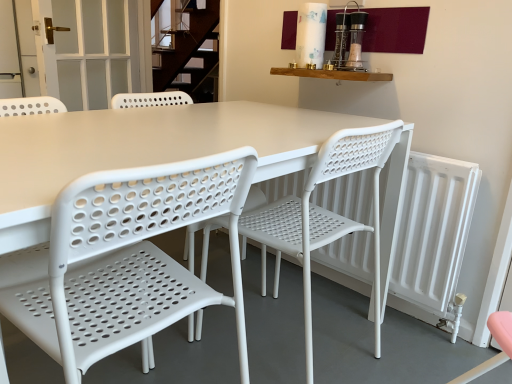
Question: Considering the relative sizes of white matte radiator at right and white plastic chair at center, placed as the 1th chair when sorted from right to left, in the image provided, is white matte radiator at right wider than white plastic chair at center, placed as the 1th chair when sorted from right to left,?

Choices:
 (A) yes
 (B) no

Answer: (B)

Question: From the image's perspective, does white matte radiator at right appear higher than white plastic chair at center, the 2th chair from the left?

Choices:
 (A) yes
 (B) no

Answer: (A)

Question: Would you say white plastic chair at center, the 2th chair from the left, is part of white matte radiator at right's contents?

Choices:
 (A) yes
 (B) no

Answer: (B)

Question: Does white matte radiator at right touch white plastic chair at center, the 2th chair from the left?

Choices:
 (A) no
 (B) yes

Answer: (A)

Question: Are white matte radiator at right and white plastic chair at center, placed as the 1th chair when sorted from right to left, far apart?

Choices:
 (A) no
 (B) yes

Answer: (A)

Question: In terms of height, does white frosted glass door at upper left look taller or shorter compared to white plastic chair at center, placed as the first chair when sorted from left to right?

Choices:
 (A) tall
 (B) short

Answer: (B)

Question: Relative to white plastic chair at center, which ranks as the second chair in right-to-left order, is white frosted glass door at upper left in front or behind?

Choices:
 (A) behind
 (B) front

Answer: (A)

Question: From the image's perspective, is white frosted glass door at upper left above or below white plastic chair at center, which ranks as the second chair in right-to-left order?

Choices:
 (A) below
 (B) above

Answer: (B)

Question: Is white frosted glass door at upper left inside the boundaries of white plastic chair at center, which ranks as the second chair in right-to-left order, or outside?

Choices:
 (A) outside
 (B) inside

Answer: (A)

Question: In terms of height, does white plastic chair at center, placed as the 1th chair when sorted from right to left, look taller or shorter compared to white plastic chair at center, which ranks as the second chair in right-to-left order?

Choices:
 (A) tall
 (B) short

Answer: (A)

Question: Is white plastic chair at center, placed as the 1th chair when sorted from right to left, inside or outside of white plastic chair at center, placed as the first chair when sorted from left to right?

Choices:
 (A) outside
 (B) inside

Answer: (A)

Question: From a real-world perspective, is white plastic chair at center, the 2th chair from the left, positioned above or below white plastic chair at center, placed as the first chair when sorted from left to right?

Choices:
 (A) above
 (B) below

Answer: (B)

Question: From the image's perspective, relative to white plastic chair at center, which ranks as the second chair in right-to-left order, is white plastic chair at center, the 2th chair from the left, above or below?

Choices:
 (A) above
 (B) below

Answer: (A)

Question: Based on their positions, is white plastic chair at center, placed as the first chair when sorted from left to right, located to the left or right of white frosted glass door at upper left?

Choices:
 (A) right
 (B) left

Answer: (A)

Question: From the image's perspective, is white plastic chair at center, placed as the first chair when sorted from left to right, located above or below white frosted glass door at upper left?

Choices:
 (A) below
 (B) above

Answer: (A)